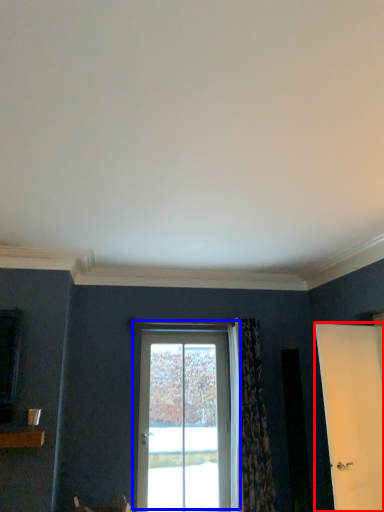
Question: Which of the following is the closest to the observer, door (highlighted by a red box) or door (highlighted by a blue box)?

Choices:
 (A) door
 (B) door

Answer: (A)